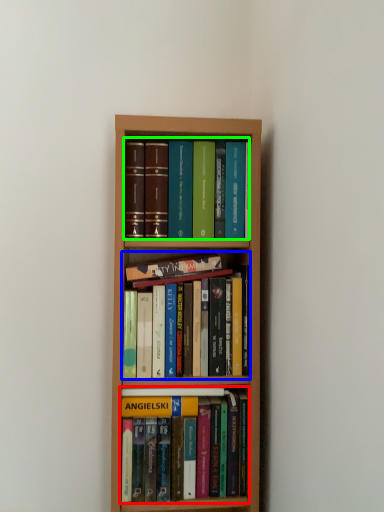
Question: Which object is positioned closest to book (highlighted by a red box)? Select from book (highlighted by a blue box) and book (highlighted by a green box).

Choices:
 (A) book
 (B) book

Answer: (A)